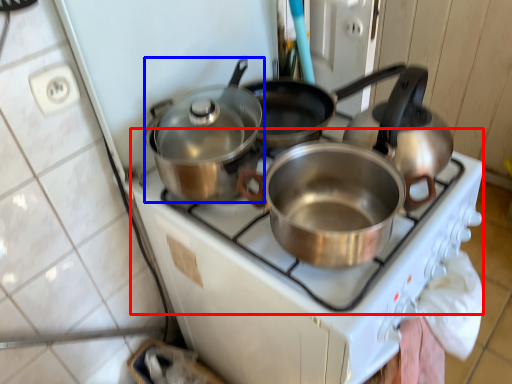
Question: Among these objects, which one is nearest to the camera, gas stove (highlighted by a red box) or kitchen appliance (highlighted by a blue box)?

Choices:
 (A) gas stove
 (B) kitchen appliance

Answer: (A)